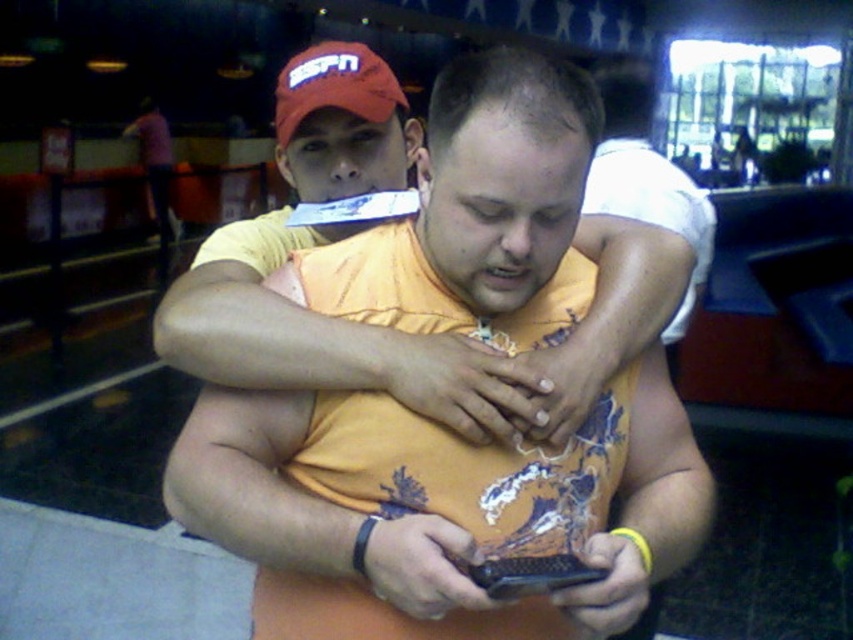
You are a photographer trying to capture a clear photo of the orange printed shirt at center and the red fabric cap at upper center. Which object would you need to adjust your camera focus on first if you want to ensure both are in focus, considering their sizes?

The orange printed shirt at center is thinner than the red fabric cap at upper center, so you should focus on the orange printed shirt at center first because smaller objects require precise focus adjustments to ensure clarity.